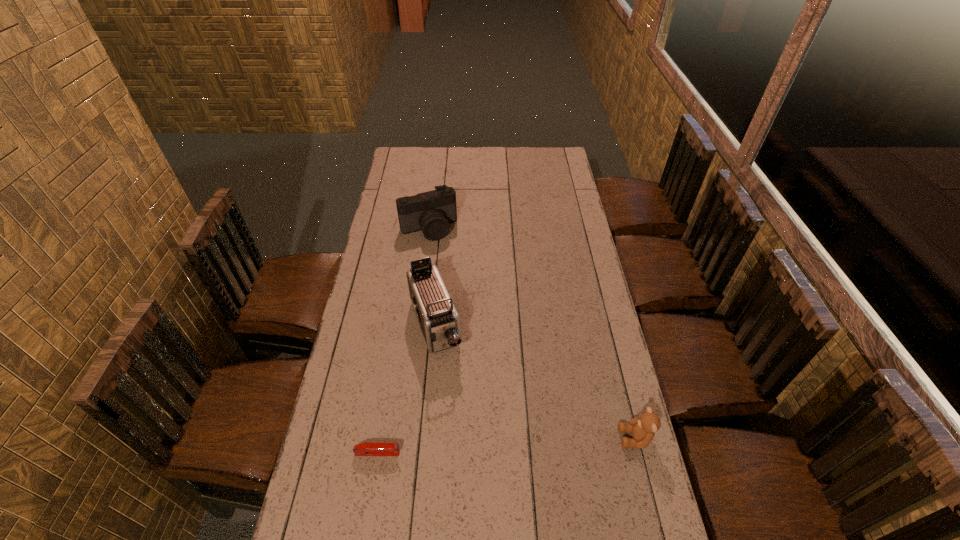
Locate an element on the screen. Image resolution: width=960 pixels, height=540 pixels. the shortest object is located at coordinates (363, 449).

The width and height of the screenshot is (960, 540). In order to click on teddy bear in this screenshot , I will do `click(643, 428)`.

Identify the location of the third tallest object. pos(643,428).

Identify the location of camcorder. Image resolution: width=960 pixels, height=540 pixels. (438, 319).

This screenshot has height=540, width=960. What are the coordinates of `the third nearest object` in the screenshot? It's located at (438, 319).

Where is `the second tallest object`? the second tallest object is located at coordinates (431, 212).

Identify the location of camera. (431, 212).

Locate an element on the screen. The image size is (960, 540). vacant space located on the front-facing side of the shortest object is located at coordinates (442, 453).

At what (x,y) coordinates should I click in order to perform the action: click on vacant space situated on the face of the teddy bear. Please return your answer as a coordinate pair (x, y). Looking at the image, I should click on (526, 438).

This screenshot has width=960, height=540. Find the location of `vacant area located on the face of the teddy bear`. vacant area located on the face of the teddy bear is located at coordinates (516, 438).